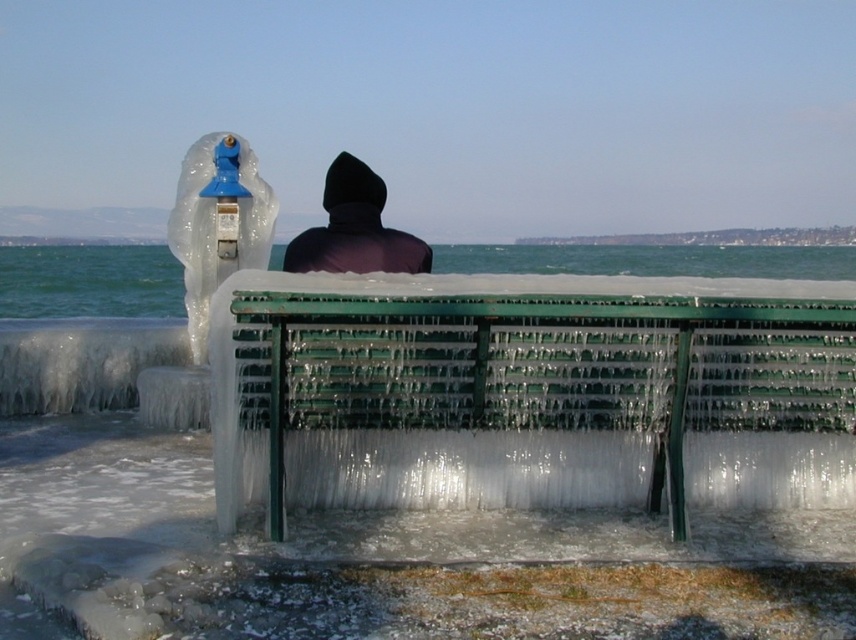
Question: Does translucent plastic ice sculpture at left have a greater width compared to dark matte hood at center?

Choices:
 (A) no
 (B) yes

Answer: (B)

Question: Which object is farther from the camera taking this photo?

Choices:
 (A) clear ice water at center
 (B) translucent plastic ice sculpture at left

Answer: (B)

Question: From the image, what is the correct spatial relationship of clear ice water at center in relation to dark matte hood at center?

Choices:
 (A) below
 (B) above

Answer: (B)

Question: Which point is farther from the camera taking this photo?

Choices:
 (A) (580, 333)
 (B) (189, 248)
 (C) (349, 164)
 (D) (587, 248)

Answer: (D)

Question: Which object is the farthest from the green plastic bench at center?

Choices:
 (A) dark matte hood at center
 (B) clear ice water at center
 (C) translucent plastic ice sculpture at left

Answer: (B)

Question: Is green plastic bench at center positioned behind dark matte hood at center?

Choices:
 (A) no
 (B) yes

Answer: (A)